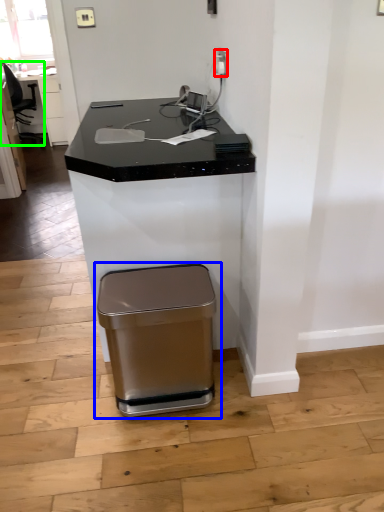
Question: Based on their relative distances, which object is farther from electric outlet (highlighted by a red box)? Choose from waste container (highlighted by a blue box) and swivel chair (highlighted by a green box).

Choices:
 (A) waste container
 (B) swivel chair

Answer: (B)